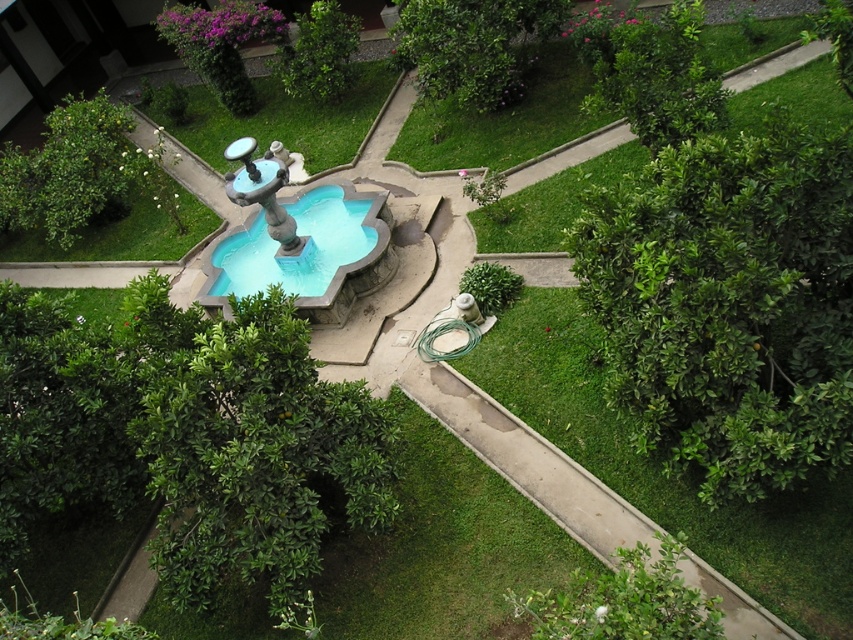
Question: Which of the following is the closest to the observer?

Choices:
 (A) coord(563,8)
 (B) coord(376,205)

Answer: (B)

Question: Which object is farther from the camera taking this photo?

Choices:
 (A) green leafy bush at upper left
 (B) green leafy bush at right
 (C) green leafy tree at upper right
 (D) green leafy tree at upper center

Answer: (D)

Question: Which of these objects is positioned closest to the blue stone fountain at center?

Choices:
 (A) green leafy bush at right
 (B) green leafy tree at upper center
 (C) green leafy tree at upper right
 (D) purple leafy bush at upper center

Answer: (B)

Question: Is blue stone fountain at center to the left of green leafy bush at upper center from the viewer's perspective?

Choices:
 (A) yes
 (B) no

Answer: (A)

Question: Can you confirm if green leafy tree at upper right is positioned below green leafy bush at upper center?

Choices:
 (A) no
 (B) yes

Answer: (B)

Question: Is green leafy tree at upper right to the right of green leafy bush at upper center from the viewer's perspective?

Choices:
 (A) yes
 (B) no

Answer: (A)